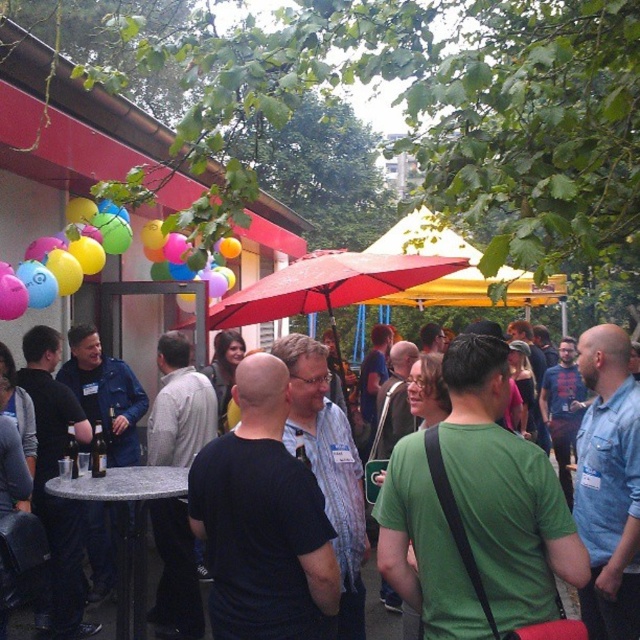
Question: Is multicolored balloons at upper left in front of black t-shirt at center?

Choices:
 (A) no
 (B) yes

Answer: (B)

Question: Is yellow fabric canopy at center to the right of black t-shirt at center from the viewer's perspective?

Choices:
 (A) no
 (B) yes

Answer: (B)

Question: Is red fabric umbrella at center bigger than multicolored balloons at upper left?

Choices:
 (A) no
 (B) yes

Answer: (B)

Question: Based on their relative distances, which object is farther from the red fabric umbrella at center?

Choices:
 (A) black t-shirt at center
 (B) multicolored balloons at upper left
 (C) yellow fabric canopy at center

Answer: (A)

Question: Which object appears farthest from the camera in this image?

Choices:
 (A) black t-shirt at center
 (B) yellow fabric canopy at center
 (C) multicolored balloons at upper left
 (D) red fabric umbrella at center

Answer: (B)

Question: Estimate the real-world distances between objects in this image. Which object is farther from the yellow fabric canopy at center?

Choices:
 (A) red fabric umbrella at center
 (B) multicolored balloons at upper left
 (C) black t-shirt at center

Answer: (B)